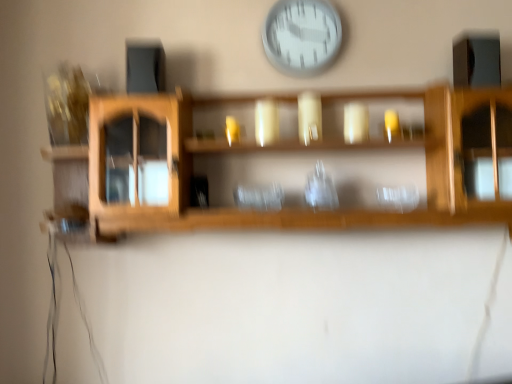
Question: From their relative heights in the image, would you say transparent glass vase at center is taller or shorter than wooden shelf at center?

Choices:
 (A) tall
 (B) short

Answer: (B)

Question: Would you say transparent glass vase at center is to the left or to the right of wooden shelf at center in the picture?

Choices:
 (A) right
 (B) left

Answer: (A)

Question: Considering the real-world distances, which object is farthest from the wooden shelf at center?

Choices:
 (A) white plastic wall clock at upper center
 (B) transparent glass vase at center

Answer: (A)

Question: Which object is positioned closest to the transparent glass vase at center?

Choices:
 (A) wooden shelf at center
 (B) white plastic wall clock at upper center

Answer: (A)